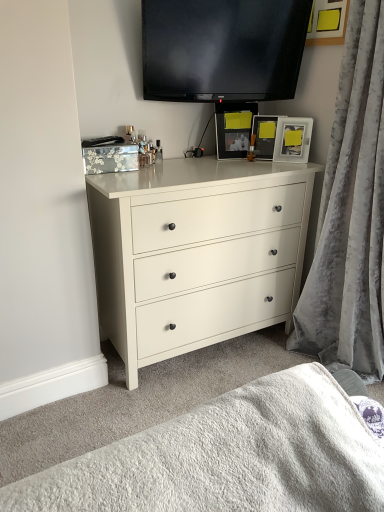
You are a GUI agent. You are given a task and a screenshot of the screen. Output one action in this format:
    pyautogui.click(x=<x>, y=<y>)
    Task: Click on the velvet gray curtain at right
    The width and height of the screenshot is (384, 512).
    Given the screenshot: What is the action you would take?
    pyautogui.click(x=350, y=213)

The height and width of the screenshot is (512, 384). Describe the element at coordinates (229, 458) in the screenshot. I see `white textured blanket at lower center` at that location.

What do you see at coordinates (264, 136) in the screenshot? The image size is (384, 512). I see `matte black picture frame at center, placed as the first picture frame when sorted from left to right` at bounding box center [264, 136].

At what (x,y) coordinates should I click in order to perform the action: click on matte silver picture frame at upper right, the second picture frame from the left. Please return your answer as a coordinate pair (x, y). The height and width of the screenshot is (512, 384). Looking at the image, I should click on (293, 139).

The height and width of the screenshot is (512, 384). What do you see at coordinates (293, 139) in the screenshot?
I see `matte silver picture frame at upper right, the second picture frame from the left` at bounding box center [293, 139].

You are a GUI agent. You are given a task and a screenshot of the screen. Output one action in this format:
    pyautogui.click(x=<x>, y=<y>)
    Task: Click on the white matte chest of drawers at center
    
    Given the screenshot: What is the action you would take?
    pyautogui.click(x=196, y=253)

Would you say matte silver picture frame at upper right, the second picture frame from the left, is outside white matte chest of drawers at center?

matte silver picture frame at upper right, the second picture frame from the left, lies outside white matte chest of drawers at center's area.

How many degrees apart are the facing directions of matte silver picture frame at upper right, the second picture frame from the left, and white matte chest of drawers at center?

47.5 degrees.

Considering the sizes of matte silver picture frame at upper right, the second picture frame from the left, and white matte chest of drawers at center in the image, is matte silver picture frame at upper right, the second picture frame from the left, bigger or smaller than white matte chest of drawers at center?

matte silver picture frame at upper right, the second picture frame from the left, is smaller than white matte chest of drawers at center.

Considering the relative sizes of matte silver picture frame at upper right, the first picture frame from the right, and white matte chest of drawers at center in the image provided, is matte silver picture frame at upper right, the first picture frame from the right, wider than white matte chest of drawers at center?

No.

In terms of height, does white textured blanket at lower center look taller or shorter compared to velvet gray curtain at right?

Considering their sizes, white textured blanket at lower center has less height than velvet gray curtain at right.

Identify the location of curtain that appears behind the white textured blanket at lower center. pos(350,213).

Looking at this image, is white textured blanket at lower center not near velvet gray curtain at right?

Yes, white textured blanket at lower center and velvet gray curtain at right are located far from each other.

Could you tell me if white textured blanket at lower center is facing velvet gray curtain at right?

No, white textured blanket at lower center is not aimed at velvet gray curtain at right.

Between point (147, 361) and point (264, 158), which one is positioned behind?

Positioned behind is point (264, 158).

The height and width of the screenshot is (512, 384). What are the coordinates of `chest of drawers in front of the matte black picture frame at center, which is the second picture frame in right-to-left order` in the screenshot? It's located at (196, 253).

Which of these two, white matte chest of drawers at center or matte black picture frame at center, which is the second picture frame in right-to-left order, is smaller?

With smaller size is matte black picture frame at center, which is the second picture frame in right-to-left order.

Between white matte chest of drawers at center and matte black picture frame at center, placed as the first picture frame when sorted from left to right, which one is positioned in front?

white matte chest of drawers at center is closer to the camera.

How different are the orientations of velvet gray curtain at right and matte black picture frame at center, placed as the first picture frame when sorted from left to right, in degrees?

43.1 degrees.

Is matte black picture frame at center, placed as the first picture frame when sorted from left to right, at the back of velvet gray curtain at right?

No, velvet gray curtain at right is not facing the opposite direction of matte black picture frame at center, placed as the first picture frame when sorted from left to right.

Do you think velvet gray curtain at right is within matte black picture frame at center, placed as the first picture frame when sorted from left to right, or outside of it?

velvet gray curtain at right is located beyond the bounds of matte black picture frame at center, placed as the first picture frame when sorted from left to right.

Considering the relative sizes of velvet gray curtain at right and matte black picture frame at center, placed as the first picture frame when sorted from left to right, in the image provided, is velvet gray curtain at right thinner than matte black picture frame at center, placed as the first picture frame when sorted from left to right,?

No.

Is white textured blanket at lower center wider or thinner than white matte chest of drawers at center?

In the image, white textured blanket at lower center appears to be more narrow than white matte chest of drawers at center.

From their relative heights in the image, would you say white textured blanket at lower center is taller or shorter than white matte chest of drawers at center?

In the image, white textured blanket at lower center appears to be shorter than white matte chest of drawers at center.

From the image's perspective, which is below, white textured blanket at lower center or white matte chest of drawers at center?

white textured blanket at lower center.

From a real-world perspective, which is physically below, white textured blanket at lower center or white matte chest of drawers at center?

In real-world perspective, white matte chest of drawers at center is lower.

Which of these two, matte silver picture frame at upper right, the second picture frame from the left, or flat screen tv at upper center, stands taller?

flat screen tv at upper center.

Is matte silver picture frame at upper right, the second picture frame from the left, located outside flat screen tv at upper center?

Yes, matte silver picture frame at upper right, the second picture frame from the left, is not within flat screen tv at upper center.

Is matte silver picture frame at upper right, the second picture frame from the left, facing away from flat screen tv at upper center?

No, matte silver picture frame at upper right, the second picture frame from the left, is not facing away from flat screen tv at upper center.

Looking at the image, does matte silver picture frame at upper right, the first picture frame from the right, seem bigger or smaller compared to flat screen tv at upper center?

matte silver picture frame at upper right, the first picture frame from the right, is smaller than flat screen tv at upper center.

Does white matte chest of drawers at center have a lesser height compared to matte silver picture frame at upper right, the second picture frame from the left?

Incorrect, the height of white matte chest of drawers at center does not fall short of that of matte silver picture frame at upper right, the second picture frame from the left.

Which object is positioned more to the right, white matte chest of drawers at center or matte silver picture frame at upper right, the first picture frame from the right?

matte silver picture frame at upper right, the first picture frame from the right.

Can you tell me how much white matte chest of drawers at center and matte silver picture frame at upper right, the first picture frame from the right, differ in facing direction?

There is a 47.5-degree angle between the facing directions of white matte chest of drawers at center and matte silver picture frame at upper right, the first picture frame from the right.

Consider the image. From the image's perspective, would you say white matte chest of drawers at center is shown under matte silver picture frame at upper right, the first picture frame from the right?

Correct, white matte chest of drawers at center appears lower than matte silver picture frame at upper right, the first picture frame from the right, in the image.

From the image's perspective, starting from the white matte chest of drawers at center, which picture frame is the 1st one above? Please provide its 2D coordinates.

[(293, 139)]

Where is `bedding in front of the velvet gray curtain at right`? The width and height of the screenshot is (384, 512). bedding in front of the velvet gray curtain at right is located at coordinates (229, 458).

Estimate the real-world distances between objects in this image. Which object is further from matte silver picture frame at upper right, the second picture frame from the left, flat screen tv at upper center or white matte chest of drawers at center?

Based on the image, white matte chest of drawers at center appears to be further to matte silver picture frame at upper right, the second picture frame from the left.

From the image, which object appears to be farther from matte silver picture frame at upper right, the first picture frame from the right, white matte chest of drawers at center or matte black picture frame at center, which is the second picture frame in right-to-left order?

white matte chest of drawers at center is positioned further to the anchor matte silver picture frame at upper right, the first picture frame from the right.

Looking at the image, which one is located closer to white matte chest of drawers at center, flat screen tv at upper center or velvet gray curtain at right?

velvet gray curtain at right is closer to white matte chest of drawers at center.

Which object lies further to the anchor point matte black picture frame at center, which is the second picture frame in right-to-left order, velvet gray curtain at right or white textured blanket at lower center?

white textured blanket at lower center lies further to matte black picture frame at center, which is the second picture frame in right-to-left order, than the other object.

Which object lies nearer to the anchor point matte silver picture frame at upper right, the first picture frame from the right, white matte chest of drawers at center or velvet gray curtain at right?

velvet gray curtain at right lies closer to matte silver picture frame at upper right, the first picture frame from the right, than the other object.

From the image, which object appears to be farther from matte silver picture frame at upper right, the first picture frame from the right, matte black picture frame at center, which is the second picture frame in right-to-left order, or velvet gray curtain at right?

velvet gray curtain at right.

When comparing their distances from white textured blanket at lower center, does matte black picture frame at center, which is the second picture frame in right-to-left order, or velvet gray curtain at right seem closer?

velvet gray curtain at right is closer to white textured blanket at lower center.

Consider the image. Estimate the real-world distances between objects in this image. Which object is closer to flat screen tv at upper center, white matte chest of drawers at center or white textured blanket at lower center?

white matte chest of drawers at center.

This screenshot has height=512, width=384. Identify the location of curtain between flat screen tv at upper center and white matte chest of drawers at center in the up-down direction. (350, 213).

Where is `picture frame between velvet gray curtain at right and matte black picture frame at center, placed as the first picture frame when sorted from left to right, in the front-back direction`? This screenshot has height=512, width=384. picture frame between velvet gray curtain at right and matte black picture frame at center, placed as the first picture frame when sorted from left to right, in the front-back direction is located at coordinates (293, 139).

Locate an element on the screen. The height and width of the screenshot is (512, 384). chest of drawers between white textured blanket at lower center and matte silver picture frame at upper right, the first picture frame from the right, along the z-axis is located at coordinates pos(196,253).

At what (x,y) coordinates should I click in order to perform the action: click on television between white textured blanket at lower center and matte black picture frame at center, which is the second picture frame in right-to-left order, in the front-back direction. Please return your answer as a coordinate pair (x, y). This screenshot has width=384, height=512. Looking at the image, I should click on (222, 49).